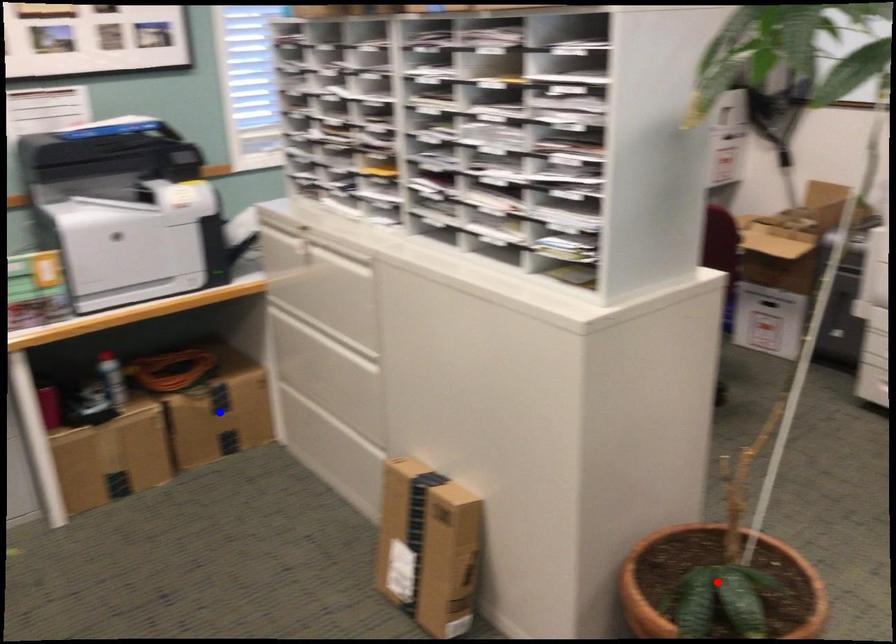
Question: In the image, two points are highlighted. Which point is nearer to the camera? Reply with the corresponding letter.

Choices:
 (A) blue point
 (B) red point

Answer: (B)